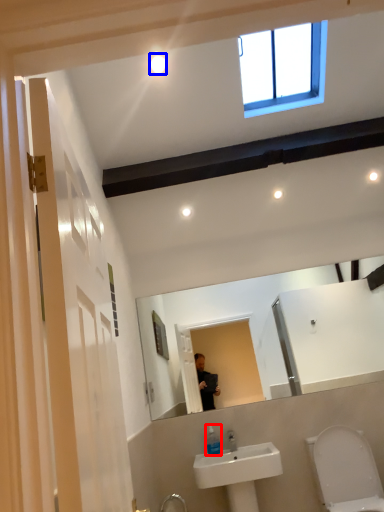
Question: Among these objects, which one is nearest to the camera, soap dispenser (highlighted by a red box) or lighting (highlighted by a blue box)?

Choices:
 (A) soap dispenser
 (B) lighting

Answer: (B)